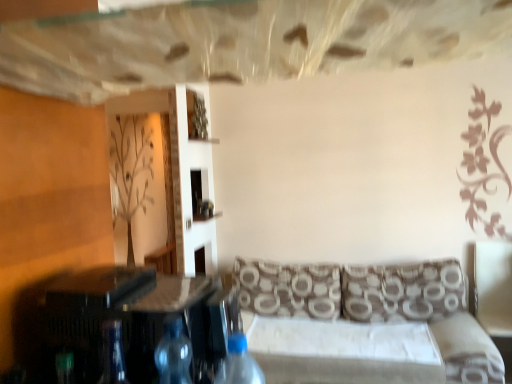
Question: Can you confirm if brown wood plywood at left is smaller than brown printed cushion at right, placed as the second pillow when sorted from left to right?

Choices:
 (A) no
 (B) yes

Answer: (A)

Question: From a real-world perspective, is brown wood plywood at left physically above brown printed cushion at right, placed as the second pillow when sorted from left to right?

Choices:
 (A) yes
 (B) no

Answer: (A)

Question: Considering the relative sizes of brown wood plywood at left and brown printed cushion at right, placed as the second pillow when sorted from left to right, in the image provided, is brown wood plywood at left bigger than brown printed cushion at right, placed as the second pillow when sorted from left to right,?

Choices:
 (A) yes
 (B) no

Answer: (A)

Question: Is brown wood plywood at left turned away from brown printed cushion at right, marked as the 1th pillow in a right-to-left arrangement?

Choices:
 (A) no
 (B) yes

Answer: (A)

Question: From the image's perspective, is brown wood plywood at left on brown printed cushion at right, marked as the 1th pillow in a right-to-left arrangement?

Choices:
 (A) no
 (B) yes

Answer: (B)

Question: Considering the relative positions of brown wood plywood at left and blue translucent bottle at lower center, which is the first bottle from right to left, in the image provided, is brown wood plywood at left to the left or to the right of blue translucent bottle at lower center, which is the first bottle from right to left,?

Choices:
 (A) left
 (B) right

Answer: (A)

Question: Looking at the image, does brown wood plywood at left seem bigger or smaller compared to blue translucent bottle at lower center, which is the first bottle from right to left?

Choices:
 (A) big
 (B) small

Answer: (A)

Question: From their relative heights in the image, would you say brown wood plywood at left is taller or shorter than blue translucent bottle at lower center, which is the first bottle from right to left?

Choices:
 (A) short
 (B) tall

Answer: (B)

Question: From a real-world perspective, relative to blue translucent bottle at lower center, which is the second bottle in left-to-right order, is brown wood plywood at left vertically above or below?

Choices:
 (A) below
 (B) above

Answer: (B)

Question: Looking at their shapes, would you say blue translucent bottle at lower center, which is the second bottle in left-to-right order, is wider or thinner than brown printed cushion at center, the second pillow viewed from the right?

Choices:
 (A) thin
 (B) wide

Answer: (A)

Question: Considering the positions of blue translucent bottle at lower center, which is the second bottle in left-to-right order, and brown printed cushion at center, the second pillow viewed from the right, in the image, is blue translucent bottle at lower center, which is the second bottle in left-to-right order, bigger or smaller than brown printed cushion at center, the second pillow viewed from the right,?

Choices:
 (A) big
 (B) small

Answer: (B)

Question: From a real-world perspective, relative to brown printed cushion at center, the second pillow viewed from the right, is blue translucent bottle at lower center, which is the first bottle from right to left, vertically above or below?

Choices:
 (A) above
 (B) below

Answer: (A)

Question: Relative to brown printed cushion at center, the second pillow viewed from the right, is blue translucent bottle at lower center, which is the first bottle from right to left, in front or behind?

Choices:
 (A) behind
 (B) front

Answer: (B)

Question: Is white leather swivel chair at right taller or shorter than transparent plastic bottle at center, which is the 2th bottle from right to left?

Choices:
 (A) short
 (B) tall

Answer: (B)

Question: Does point (494, 274) appear closer or farther from the camera than point (156, 350)?

Choices:
 (A) farther
 (B) closer

Answer: (A)